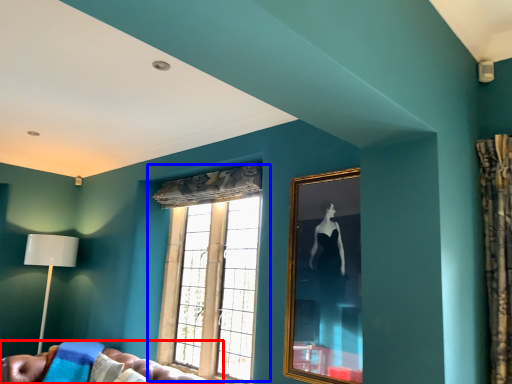
Question: Which point is further to the camera, studio couch (highlighted by a red box) or window (highlighted by a blue box)?

Choices:
 (A) studio couch
 (B) window

Answer: (B)